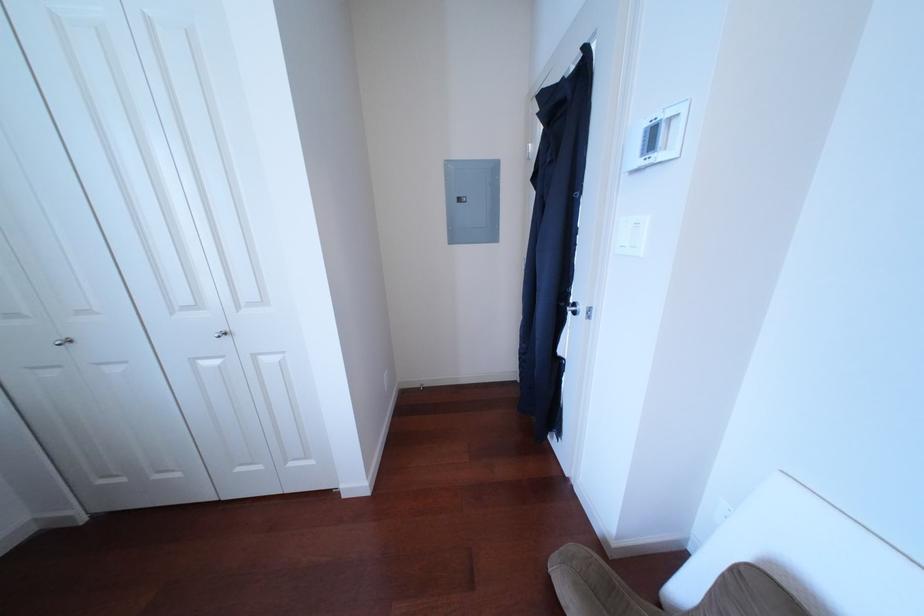
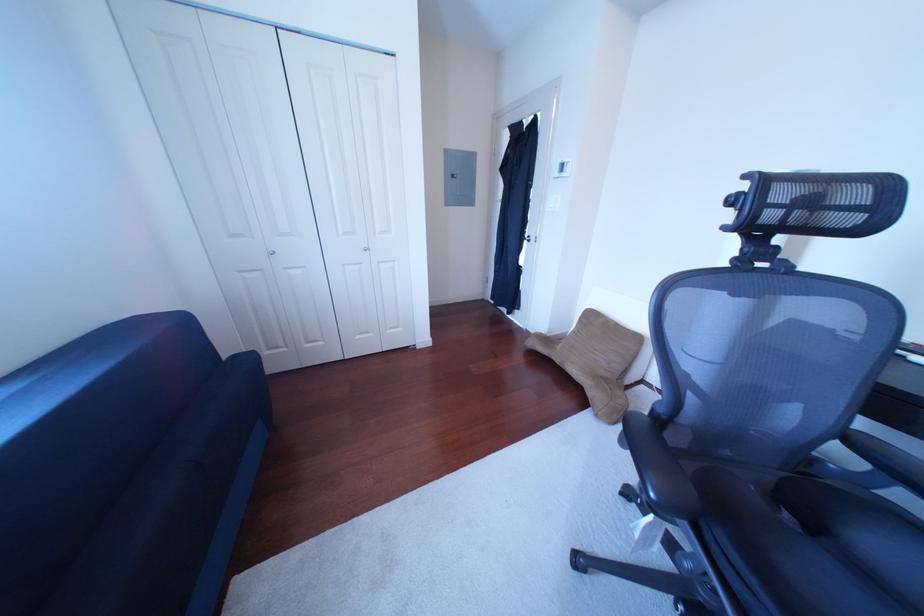
Consider the image. In a continuous first-person perspective shot, in which direction is the camera moving?

The cameraman moved toward left, backward.